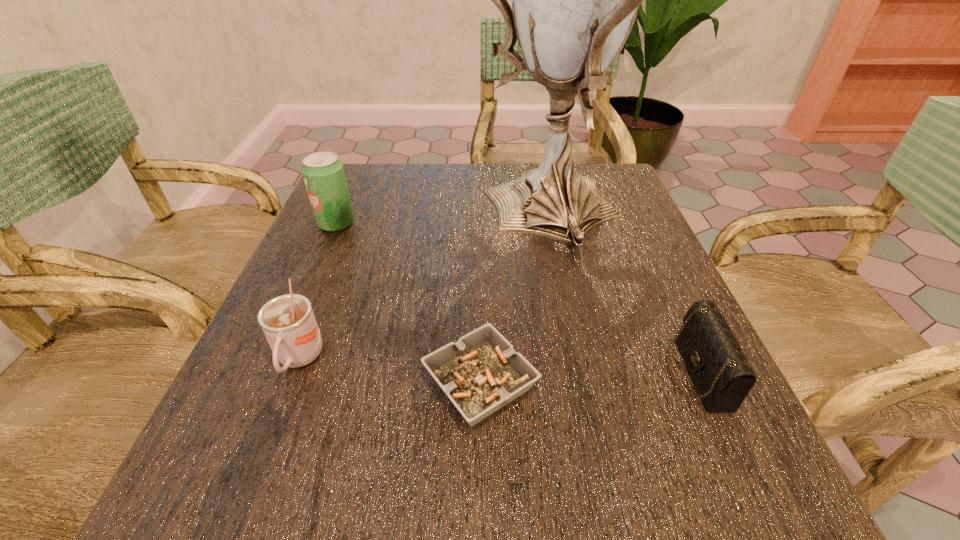
I want to click on vacant region at the left edge, so click(x=324, y=421).

Find the location of `vacant space at the right edge of the desktop`. vacant space at the right edge of the desktop is located at coordinates (599, 264).

Locate an element on the screen. This screenshot has height=540, width=960. vacant space at the far left corner of the desktop is located at coordinates (351, 172).

You are a GUI agent. You are given a task and a screenshot of the screen. Output one action in this format:
    pyautogui.click(x=<x>, y=<y>)
    Task: Click on the blank space at the near left corner
    Image resolution: width=960 pixels, height=540 pixels.
    Given the screenshot: What is the action you would take?
    pyautogui.click(x=239, y=467)

The width and height of the screenshot is (960, 540). What are the coordinates of `vacant area at the far right corner of the desktop` in the screenshot? It's located at (610, 194).

I want to click on blank space at the near right corner of the desktop, so (x=694, y=501).

Locate an element on the screen. This screenshot has width=960, height=540. vacant area between the tallest object and the ashtray is located at coordinates (515, 299).

The height and width of the screenshot is (540, 960). Identify the location of unoccupied position between the ashtray and the cup. (390, 372).

Where is `free space that is in between the second shortest object and the tallest object`? free space that is in between the second shortest object and the tallest object is located at coordinates (622, 293).

Locate an element on the screen. empty location between the trophy cup and the ashtray is located at coordinates (515, 299).